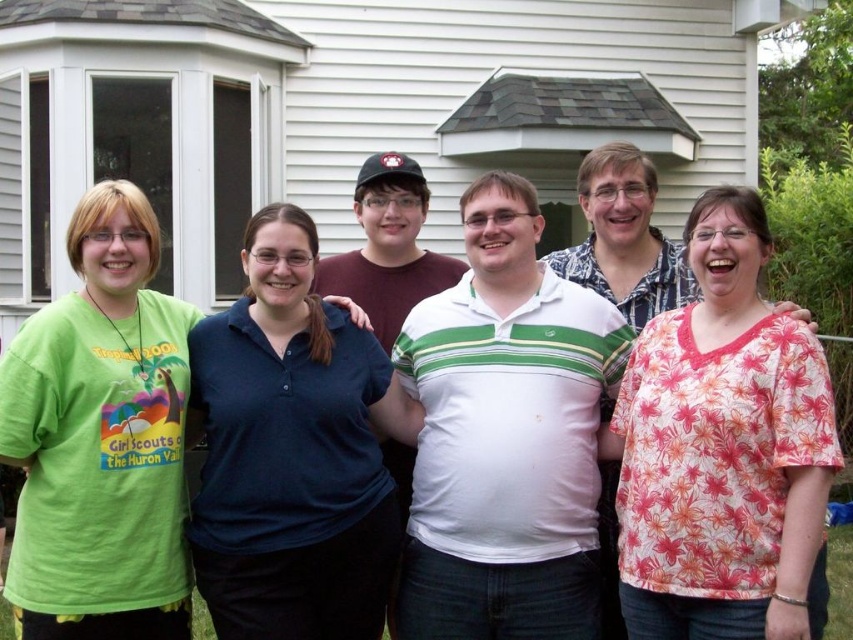
You are a photographer trying to capture a group photo where the floral print blouse at center and the dark blue polo shirt at center are both visible. Which clothing item should you adjust to ensure both are fully visible in the frame?

The floral print blouse at center is positioned on the right side of dark blue polo shirt at center, so adjusting the dark blue polo shirt at center to move it further left would allow both items to be fully visible in the frame.

You are standing at the origin point of the image coordinate system. You want to walk to the point labeled as point (x=689, y=314). However, there is an obstacle at point (x=42, y=568). Will you encounter the obstacle on your way?

Yes, you will encounter the obstacle at point (x=42, y=568) because point (x=689, y=314) is behind it, meaning the obstacle is in your path to reach the target point.